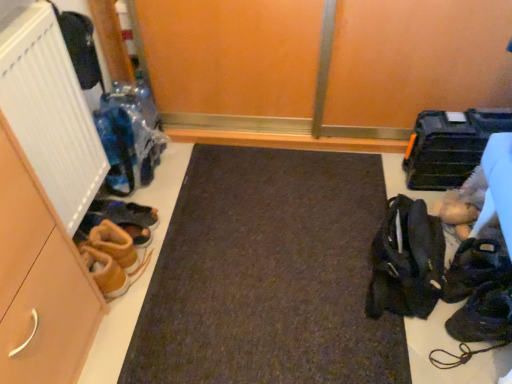
Question: From a real-world perspective, relative to dark brown leather shoes at lower right, which appears as the 3th footwear when viewed from the left, is black fabric bag at right vertically above or below?

Choices:
 (A) below
 (B) above

Answer: (B)

Question: Visually, is black fabric bag at right positioned to the left or to the right of dark brown leather shoes at lower right, which appears as the 3th footwear when viewed from the left?

Choices:
 (A) left
 (B) right

Answer: (A)

Question: Considering the real-world distances, which object is closest to the black fabric bag at right?

Choices:
 (A) black leather shoes at lower right, the 4th footwear viewed from the left
 (B) dark brown leather shoes at lower right, which appears as the 3th footwear when viewed from the left
 (C) white ribbed radiator at left
 (D) brown suede shoes at left, the third footwear viewed from the right
 (E) brown suede shoes at lower left, which appears as the first footwear when viewed from the left

Answer: (A)

Question: Estimate the real-world distances between objects in this image. Which object is closer to the matte brown cabinet at left?

Choices:
 (A) white ribbed radiator at left
 (B) dark brown leather shoes at lower right, which is the second footwear from right to left
 (C) black fabric bag at right
 (D) black leather shoes at lower right, the 4th footwear viewed from the left
 (E) brown suede shoes at lower left, which is counted as the 4th footwear, starting from the right

Answer: (E)